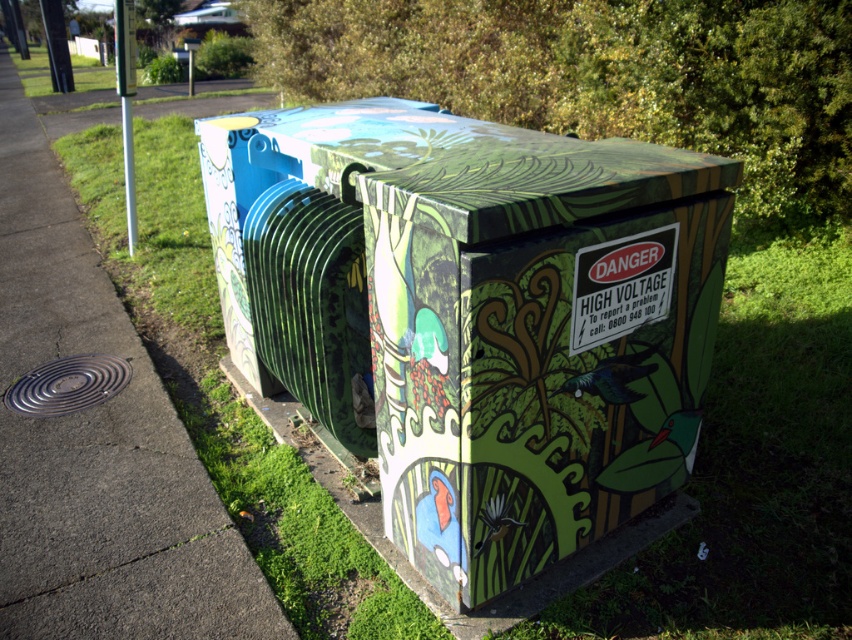
Can you confirm if matte green painted box at center is bigger than concrete sidewalk at lower left?

No, matte green painted box at center is not bigger than concrete sidewalk at lower left.

Which is more to the right, matte green painted box at center or concrete sidewalk at lower left?

From the viewer's perspective, matte green painted box at center appears more on the right side.

Who is more forward, (534, 472) or (38, 566)?

Positioned in front is point (534, 472).

Where is `matte green painted box at center`? matte green painted box at center is located at coordinates (482, 316).